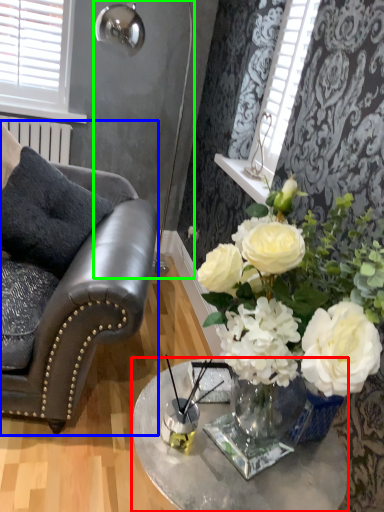
Question: Considering the real-world distances, which object is farthest from table (highlighted by a red box)? chair (highlighted by a blue box) or lamp (highlighted by a green box)?

Choices:
 (A) chair
 (B) lamp

Answer: (B)